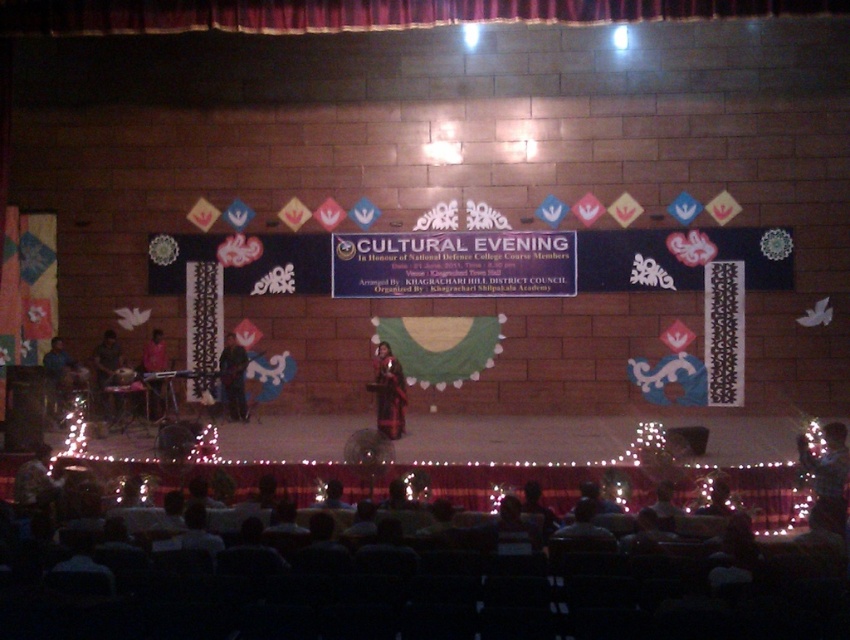
Question: Can you confirm if dark blue fabric at center is wider than blue fabric at stage left?

Choices:
 (A) yes
 (B) no

Answer: (B)

Question: Based on their relative distances, which object is nearer to the dark red fabric dress at center?

Choices:
 (A) matte black keyboard at center
 (B) velvet red curtain at upper center
 (C) blue fabric at stage left
 (D) pink fabric at stage left

Answer: (D)

Question: Does velvet red curtain at upper center have a smaller size compared to dark blue fabric at center?

Choices:
 (A) no
 (B) yes

Answer: (A)

Question: Does silky black dress at center come in front of matte black keyboard at center?

Choices:
 (A) yes
 (B) no

Answer: (A)

Question: Which of the following is the closest to the observer?

Choices:
 (A) silky black dress at center
 (B) blue fabric at stage left
 (C) matte black keyboard at center

Answer: (A)

Question: Which object is positioned farthest from the pink fabric at stage left?

Choices:
 (A) blue fabric at stage left
 (B) velvet red curtain at upper center

Answer: (B)